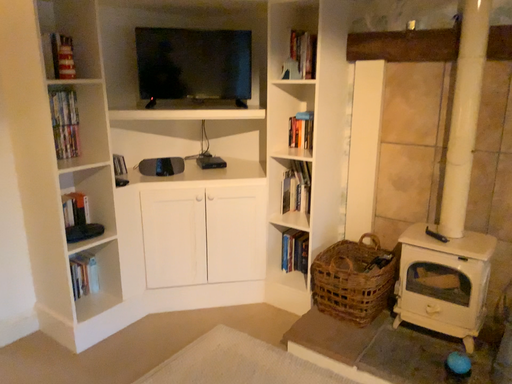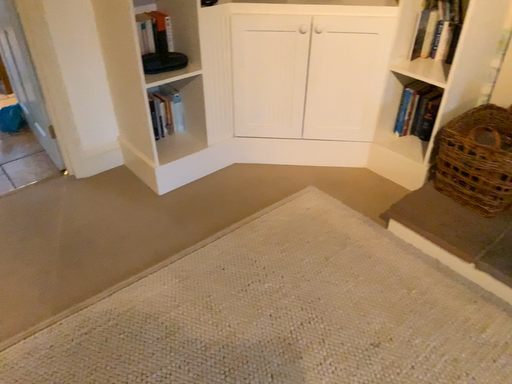
Question: Which way did the camera rotate in the video?

Choices:
 (A) rotated right
 (B) rotated left

Answer: (B)